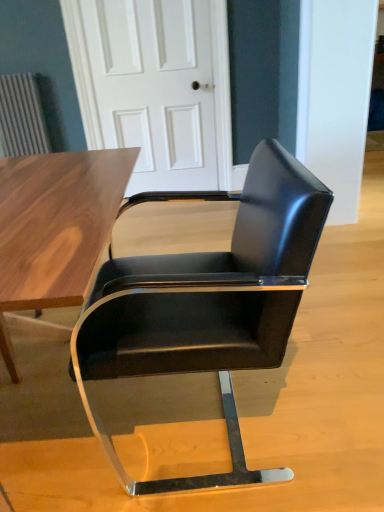
Question: In the image, is white glossy door at center positioned in front of or behind black leather chair at center?

Choices:
 (A) behind
 (B) front

Answer: (A)

Question: Is white glossy door at center taller or shorter than black leather chair at center?

Choices:
 (A) short
 (B) tall

Answer: (B)

Question: Does point (213, 77) appear closer or farther from the camera than point (134, 300)?

Choices:
 (A) closer
 (B) farther

Answer: (B)

Question: Is black leather chair at center bigger or smaller than white glossy door at center?

Choices:
 (A) small
 (B) big

Answer: (B)

Question: From a real-world perspective, is black leather chair at center positioned above or below white glossy door at center?

Choices:
 (A) above
 (B) below

Answer: (B)

Question: Considering the positions of black leather chair at center and white glossy door at center in the image, is black leather chair at center wider or thinner than white glossy door at center?

Choices:
 (A) wide
 (B) thin

Answer: (A)

Question: Considering their positions, is black leather chair at center located in front of or behind white glossy door at center?

Choices:
 (A) front
 (B) behind

Answer: (A)